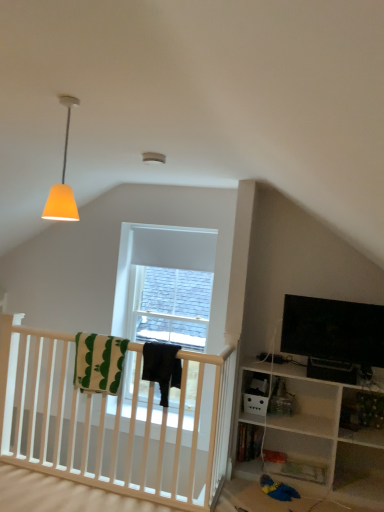
What do you see at coordinates (63, 180) in the screenshot? I see `orange matte lampshade at upper left` at bounding box center [63, 180].

The image size is (384, 512). I want to click on wooden bookshelf at lower right, so click(x=362, y=416).

What do you see at coordinates (333, 330) in the screenshot?
I see `black glossy tv at right` at bounding box center [333, 330].

You are a GUI agent. You are given a task and a screenshot of the screen. Output one action in this format:
    pyautogui.click(x=<x>, y=<y>)
    Task: Click on the orange matte lampshade at upper left
    The width and height of the screenshot is (384, 512).
    Given the screenshot: What is the action you would take?
    pyautogui.click(x=63, y=180)

From a real-world perspective, does black fabric at center, the second blanket when ordered from left to right, sit lower than white cotton blanket at center, the second blanket in the right-to-left sequence?

Actually, black fabric at center, the second blanket when ordered from left to right, is physically above white cotton blanket at center, the second blanket in the right-to-left sequence, in the real world.

From the image's perspective, is black fabric at center, placed as the 1th blanket when sorted from right to left, below white cotton blanket at center, positioned as the first blanket in left-to-right order?

Correct, black fabric at center, placed as the 1th blanket when sorted from right to left, appears lower than white cotton blanket at center, positioned as the first blanket in left-to-right order, in the image.

Which is closer to the camera, (143, 353) or (82, 379)?

The point (143, 353) is in front.

Considering the sizes of black fabric at center, placed as the 1th blanket when sorted from right to left, and white cotton blanket at center, positioned as the first blanket in left-to-right order, in the image, is black fabric at center, placed as the 1th blanket when sorted from right to left, wider or thinner than white cotton blanket at center, positioned as the first blanket in left-to-right order,?

In the image, black fabric at center, placed as the 1th blanket when sorted from right to left, appears to be wider than white cotton blanket at center, positioned as the first blanket in left-to-right order.

Is orange matte lampshade at upper left located within white cotton blanket at center, the second blanket in the right-to-left sequence?

Definitely not — orange matte lampshade at upper left is not inside white cotton blanket at center, the second blanket in the right-to-left sequence.

Considering the relative positions of white cotton blanket at center, positioned as the first blanket in left-to-right order, and orange matte lampshade at upper left in the image provided, is white cotton blanket at center, positioned as the first blanket in left-to-right order, to the left of orange matte lampshade at upper left from the viewer's perspective?

Yes, white cotton blanket at center, positioned as the first blanket in left-to-right order, is to the left of orange matte lampshade at upper left.

From a real-world perspective, is white cotton blanket at center, positioned as the first blanket in left-to-right order, above or below orange matte lampshade at upper left?

Clearly, from a real-world perspective, white cotton blanket at center, positioned as the first blanket in left-to-right order, is below orange matte lampshade at upper left.

Who is taller, white cotton blanket at center, positioned as the first blanket in left-to-right order, or orange matte lampshade at upper left?

orange matte lampshade at upper left is taller.

Is white cotton blanket at center, positioned as the first blanket in left-to-right order, looking in the opposite direction of wooden bookshelf at lower right?

white cotton blanket at center, positioned as the first blanket in left-to-right order, does not have its back to wooden bookshelf at lower right.

Considering the sizes of objects white cotton blanket at center, positioned as the first blanket in left-to-right order, and wooden bookshelf at lower right in the image provided, who is taller, white cotton blanket at center, positioned as the first blanket in left-to-right order, or wooden bookshelf at lower right?

white cotton blanket at center, positioned as the first blanket in left-to-right order, is taller.

From a real-world perspective, which is physically above, white cotton blanket at center, positioned as the first blanket in left-to-right order, or wooden bookshelf at lower right?

In real-world perspective, white cotton blanket at center, positioned as the first blanket in left-to-right order, is above.

Where is `shelf that appears behind the white cotton blanket at center, positioned as the first blanket in left-to-right order`? The height and width of the screenshot is (512, 384). shelf that appears behind the white cotton blanket at center, positioned as the first blanket in left-to-right order is located at coordinates (362, 416).

From a real-world perspective, is black glossy tv at right on top of white cotton blanket at center, positioned as the first blanket in left-to-right order?

Yes.

Is black glossy tv at right beside white cotton blanket at center, positioned as the first blanket in left-to-right order?

They are not placed beside each other.

Considering the relative sizes of black glossy tv at right and white cotton blanket at center, the second blanket in the right-to-left sequence, in the image provided, is black glossy tv at right smaller than white cotton blanket at center, the second blanket in the right-to-left sequence,?

Incorrect, black glossy tv at right is not smaller in size than white cotton blanket at center, the second blanket in the right-to-left sequence.

This screenshot has width=384, height=512. Identify the location of shelf directly beneath the black glossy tv at right (from a real-world perspective). (362, 416).

Considering the relative positions of wooden bookshelf at lower right and black glossy tv at right in the image provided, is wooden bookshelf at lower right to the left of black glossy tv at right from the viewer's perspective?

Incorrect, wooden bookshelf at lower right is not on the left side of black glossy tv at right.

Is wooden bookshelf at lower right located outside black glossy tv at right?

wooden bookshelf at lower right lies outside black glossy tv at right's area.

Can you tell me how much wooden bookshelf at lower right and white cotton blanket at center, positioned as the first blanket in left-to-right order, differ in facing direction?

The angle between the facing direction of wooden bookshelf at lower right and the facing direction of white cotton blanket at center, positioned as the first blanket in left-to-right order, is 0.000467 degrees.

Visually, is wooden bookshelf at lower right positioned to the left or to the right of white cotton blanket at center, positioned as the first blanket in left-to-right order?

From the image, it's evident that wooden bookshelf at lower right is to the right of white cotton blanket at center, positioned as the first blanket in left-to-right order.

Considering the sizes of objects wooden bookshelf at lower right and white cotton blanket at center, positioned as the first blanket in left-to-right order, in the image provided, who is taller, wooden bookshelf at lower right or white cotton blanket at center, positioned as the first blanket in left-to-right order,?

white cotton blanket at center, positioned as the first blanket in left-to-right order, is taller.

Is wooden bookshelf at lower right inside the boundaries of white cotton blanket at center, the second blanket in the right-to-left sequence, or outside?

wooden bookshelf at lower right is not enclosed by white cotton blanket at center, the second blanket in the right-to-left sequence.

Which of these two, orange matte lampshade at upper left or wooden bookshelf at lower right, is bigger?

With larger size is orange matte lampshade at upper left.

Is orange matte lampshade at upper left next to wooden bookshelf at lower right?

No, orange matte lampshade at upper left is not with wooden bookshelf at lower right.

Can you confirm if orange matte lampshade at upper left is taller than wooden bookshelf at lower right?

Yes, orange matte lampshade at upper left is taller than wooden bookshelf at lower right.

Between orange matte lampshade at upper left and wooden bookshelf at lower right, which one appears on the left side from the viewer's perspective?

From the viewer's perspective, orange matte lampshade at upper left appears more on the left side.

Image resolution: width=384 pixels, height=512 pixels. Identify the location of blanket on the left of black fabric at center, placed as the 1th blanket when sorted from right to left. (99, 362).

From the orange matte lampshade at upper left, count 2nd blankets backward and point to it. Please provide its 2D coordinates.

[(99, 362)]

Considering their positions, is wooden bookshelf at lower right positioned further to black fabric at center, placed as the 1th blanket when sorted from right to left, than black glossy tv at right?

Among the two, wooden bookshelf at lower right is located further to black fabric at center, placed as the 1th blanket when sorted from right to left.

Which object lies nearer to the anchor point orange matte lampshade at upper left, wooden bookshelf at lower right or black glossy tv at right?

black glossy tv at right is closer to orange matte lampshade at upper left.

Considering their positions, is white cotton blanket at center, positioned as the first blanket in left-to-right order, positioned further to black glossy tv at right than black fabric at center, the second blanket when ordered from left to right?

Among the two, white cotton blanket at center, positioned as the first blanket in left-to-right order, is located further to black glossy tv at right.

Which object lies nearer to the anchor point white cotton blanket at center, the second blanket in the right-to-left sequence, black glossy tv at right or wooden bookshelf at lower right?

black glossy tv at right is closer to white cotton blanket at center, the second blanket in the right-to-left sequence.

When comparing their distances from black glossy tv at right, does orange matte lampshade at upper left or wooden bookshelf at lower right seem further?

orange matte lampshade at upper left.

Looking at the image, which one is located closer to black fabric at center, the second blanket when ordered from left to right, orange matte lampshade at upper left or black glossy tv at right?

The object closer to black fabric at center, the second blanket when ordered from left to right, is black glossy tv at right.

Considering their positions, is black glossy tv at right positioned further to white cotton blanket at center, positioned as the first blanket in left-to-right order, than black fabric at center, placed as the 1th blanket when sorted from right to left?

black glossy tv at right is further to white cotton blanket at center, positioned as the first blanket in left-to-right order.

When comparing their distances from wooden bookshelf at lower right, does orange matte lampshade at upper left or black fabric at center, placed as the 1th blanket when sorted from right to left, seem closer?

Based on the image, black fabric at center, placed as the 1th blanket when sorted from right to left, appears to be nearer to wooden bookshelf at lower right.

You are a GUI agent. You are given a task and a screenshot of the screen. Output one action in this format:
    pyautogui.click(x=<x>, y=<y>)
    Task: Click on the blanket between white cotton blanket at center, the second blanket in the right-to-left sequence, and wooden bookshelf at lower right
    The height and width of the screenshot is (512, 384).
    Given the screenshot: What is the action you would take?
    pyautogui.click(x=162, y=367)

Image resolution: width=384 pixels, height=512 pixels. In order to click on blanket that lies between orange matte lampshade at upper left and black fabric at center, the second blanket when ordered from left to right, from top to bottom in this screenshot , I will do `click(99, 362)`.

Find the location of a particular element. The width and height of the screenshot is (384, 512). television between white cotton blanket at center, the second blanket in the right-to-left sequence, and wooden bookshelf at lower right, in the horizontal direction is located at coordinates (333, 330).

Where is `blanket between orange matte lampshade at upper left and black glossy tv at right`? This screenshot has width=384, height=512. blanket between orange matte lampshade at upper left and black glossy tv at right is located at coordinates (162, 367).